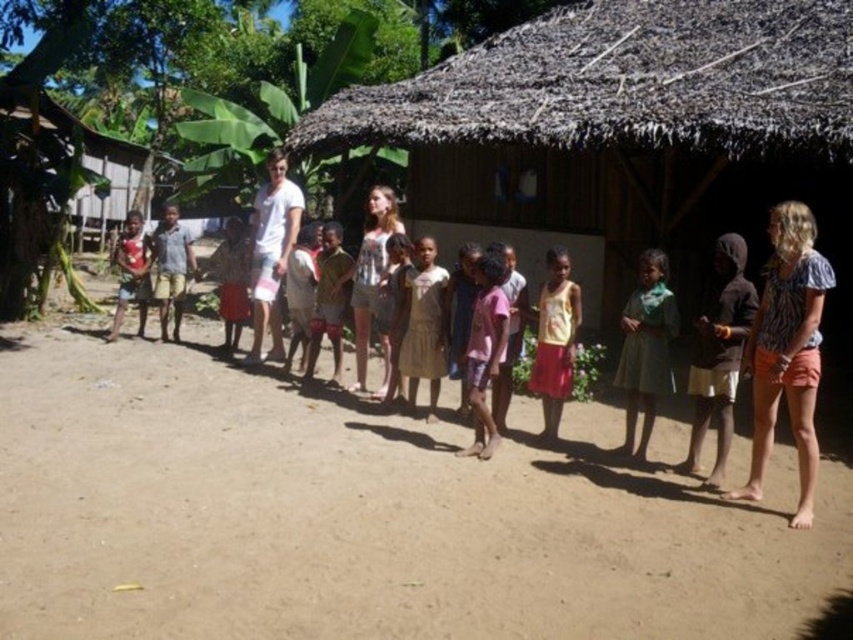
Question: Is striped cotton shirt at right in front of light brown shorts at left?

Choices:
 (A) yes
 (B) no

Answer: (A)

Question: Which of the following is the farthest from the observer?

Choices:
 (A) (167, 218)
 (B) (798, 342)
 (C) (674, 330)
 (D) (488, 307)

Answer: (A)

Question: Is brown sandy ground at center wider than brown thatched roof at center?

Choices:
 (A) yes
 (B) no

Answer: (A)

Question: Estimate the real-world distances between objects in this image. Which object is closer to the light brown shorts at left?

Choices:
 (A) green fabric dress at center
 (B) brown thatched roof at center
 (C) striped cotton shirt at right
 (D) yellow cotton tank top at center

Answer: (D)

Question: Observing the image, what is the correct spatial positioning of striped cotton shirt at right in reference to pink fabric dress at center?

Choices:
 (A) below
 (B) above

Answer: (A)

Question: Which of the following is the closest to the observer?

Choices:
 (A) (558, 413)
 (B) (805, 348)

Answer: (B)